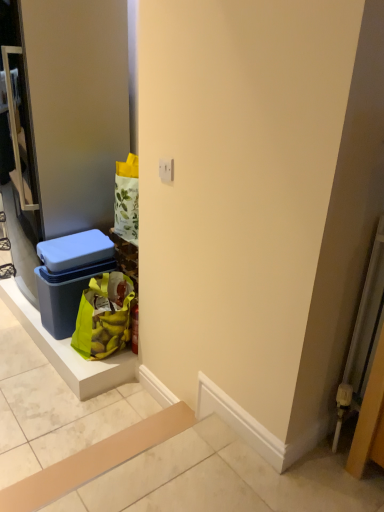
Question: Does blue plastic door at left have a larger size compared to green fabric shopping bag at lower left?

Choices:
 (A) yes
 (B) no

Answer: (A)

Question: Is blue plastic door at left thinner than green fabric shopping bag at lower left?

Choices:
 (A) no
 (B) yes

Answer: (A)

Question: From the image's perspective, would you say blue plastic door at left is shown under green fabric shopping bag at lower left?

Choices:
 (A) no
 (B) yes

Answer: (A)

Question: Is blue plastic door at left smaller than green fabric shopping bag at lower left?

Choices:
 (A) no
 (B) yes

Answer: (A)

Question: Is blue plastic door at left touching green fabric shopping bag at lower left?

Choices:
 (A) no
 (B) yes

Answer: (A)

Question: Does blue plastic door at left appear on the left side of green fabric shopping bag at lower left?

Choices:
 (A) no
 (B) yes

Answer: (B)

Question: Would you consider blue plastic storage box at left to be distant from blue plastic door at left?

Choices:
 (A) no
 (B) yes

Answer: (A)

Question: Does blue plastic storage box at left have a greater width compared to blue plastic door at left?

Choices:
 (A) yes
 (B) no

Answer: (B)

Question: Is blue plastic storage box at left positioned with its back to blue plastic door at left?

Choices:
 (A) no
 (B) yes

Answer: (A)

Question: Is blue plastic storage box at left taller than blue plastic door at left?

Choices:
 (A) no
 (B) yes

Answer: (A)

Question: Would you say blue plastic door at left is part of blue plastic storage box at left's contents?

Choices:
 (A) no
 (B) yes

Answer: (A)

Question: Can we say blue plastic storage box at left lies outside blue plastic door at left?

Choices:
 (A) yes
 (B) no

Answer: (A)

Question: Is green fabric shopping bag at lower left positioned beyond the bounds of blue plastic storage box at left?

Choices:
 (A) yes
 (B) no

Answer: (A)